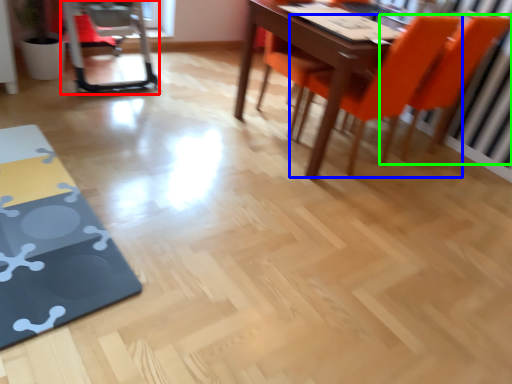
Question: Which object is the farthest from swivel chair (highlighted by a red box)? Choose among these: chair (highlighted by a blue box) or chair (highlighted by a green box).

Choices:
 (A) chair
 (B) chair

Answer: (B)